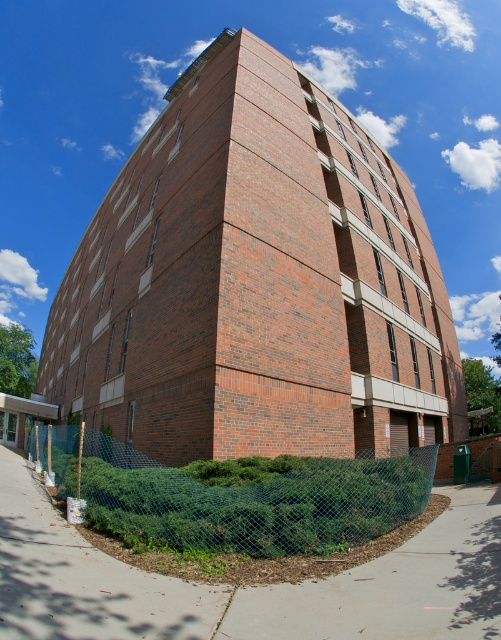
Question: Does gray concrete pavement at lower center appear over blue mesh fence at lower left?

Choices:
 (A) no
 (B) yes

Answer: (B)

Question: Can you confirm if gray concrete pavement at lower center is thinner than blue mesh fence at lower left?

Choices:
 (A) yes
 (B) no

Answer: (A)

Question: Is gray concrete pavement at lower center to the right of blue mesh fence at lower left from the viewer's perspective?

Choices:
 (A) yes
 (B) no

Answer: (A)